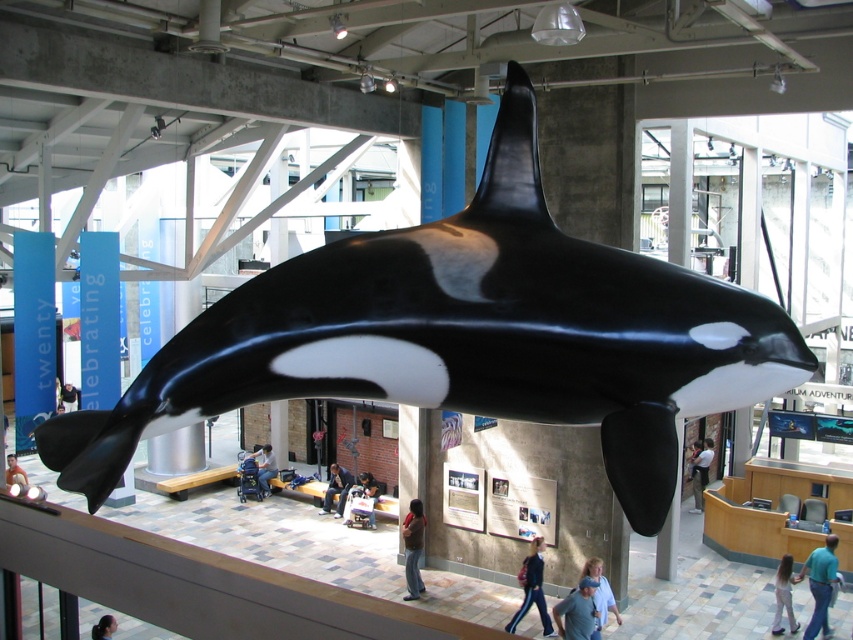
Question: Which point appears closest to the camera in this image?

Choices:
 (A) (9, 476)
 (B) (270, 458)
 (C) (68, 387)
 (D) (579, 604)

Answer: (D)

Question: Is the position of blue denim jeans at lower center more distant than that of light blue jeans at center?

Choices:
 (A) no
 (B) yes

Answer: (A)

Question: Which of the following is the farthest from the observer?

Choices:
 (A) black glossy orca at center
 (B) light brown leather jacket at lower left
 (C) denim jacket at center
 (D) brown leather jacket at lower center

Answer: (C)

Question: Is light brown leather jacket at lower center positioned before light brown leather jacket at lower left?

Choices:
 (A) yes
 (B) no

Answer: (A)

Question: Can you confirm if denim pants at lower center is positioned above blonde hair at center?

Choices:
 (A) yes
 (B) no

Answer: (B)

Question: Estimate the real-world distances between objects in this image. Which object is closer to the denim jacket at center?

Choices:
 (A) black glossy orca at center
 (B) light brown leather jacket at lower left
 (C) denim jacket at lower center

Answer: (C)